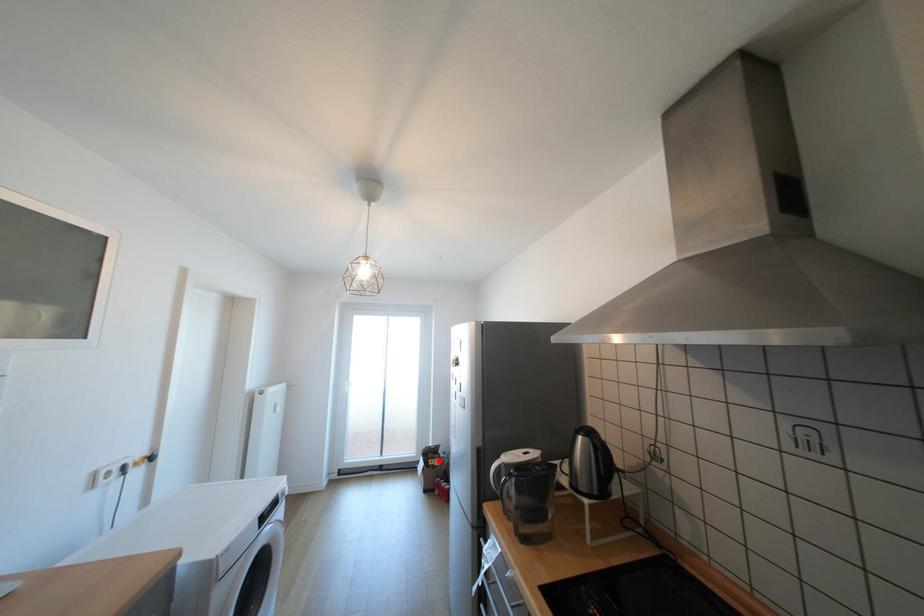
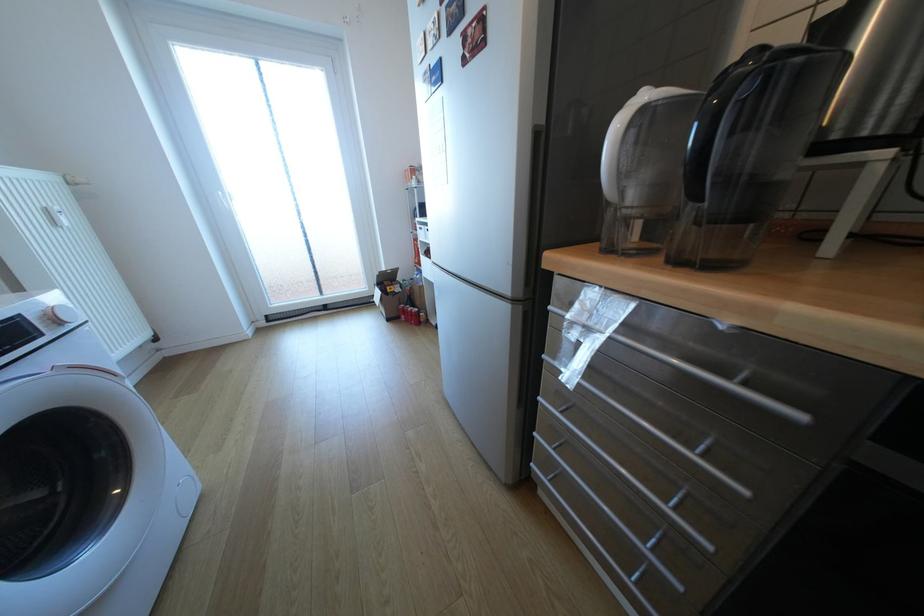
The point at the highlighted location is marked in the first image. Where is the corresponding point in the second image?

(397, 288)